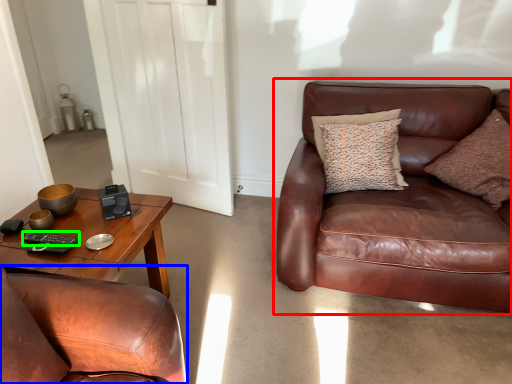
Question: Based on their relative distances, which object is nearer to studio couch (highlighted by a red box)? Choose from chair (highlighted by a blue box) and remote (highlighted by a green box).

Choices:
 (A) chair
 (B) remote

Answer: (A)